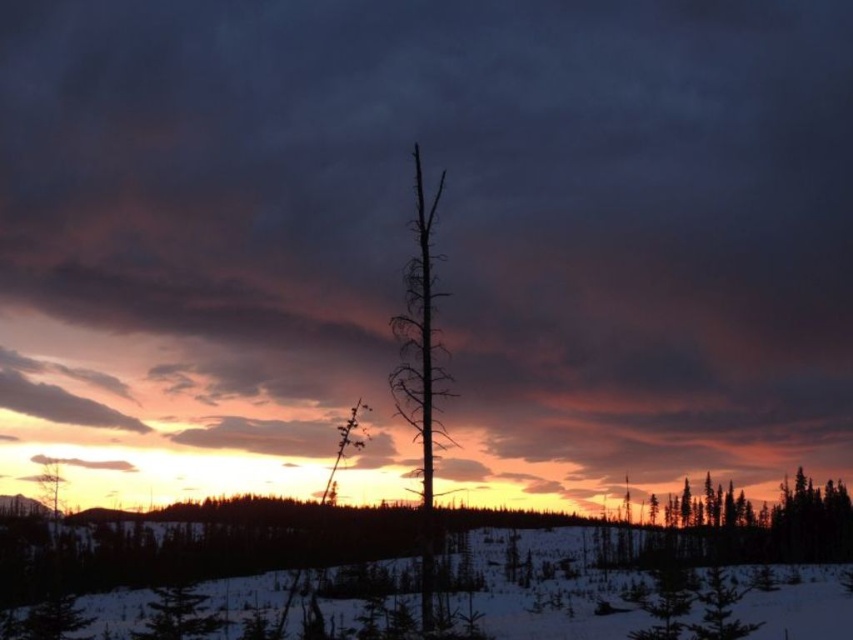
You are an artist trying to paint this winter scene. You want to place the green matte tree at center in your painting so that it aligns with the white powdery snow at lower center. According to the image, where should you position the green matte tree relative to the snow?

A: The white powdery snow at lower center is to the left of the green matte tree at center, so you should position the green matte tree at center to the right of the white powdery snow at lower center.

You are standing at the point marked by the coordinates point (x=550, y=588) in the winter landscape. What is the terrain like under your feet?

The point (x=550, y=588) corresponds to white powdery snow at lower center, so the terrain under your feet is covered in white powdery snow.